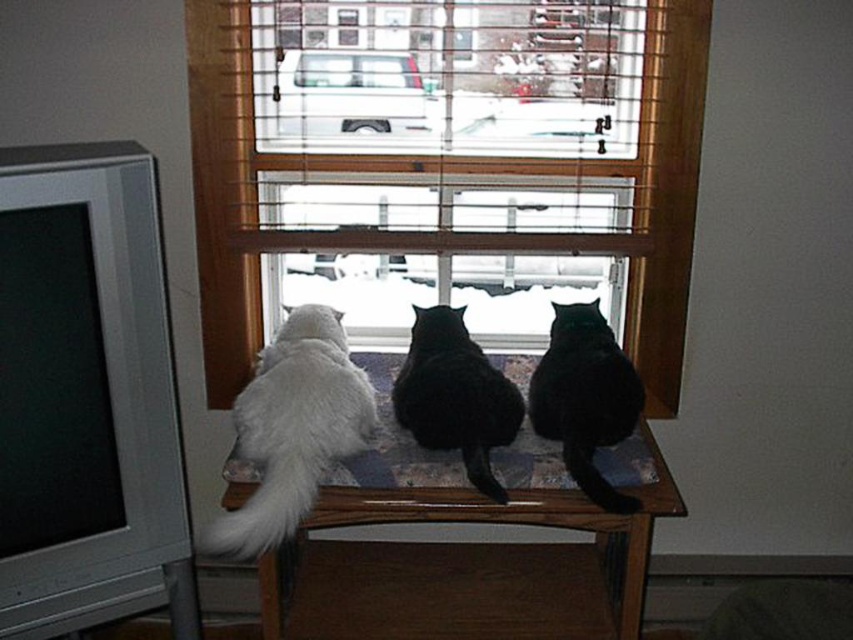
You are a photographer trying to capture the cats on the wooden table near the window. You want to arrange them so that the white fluffy cat at center is to the right of the black fur cat at center. Is this possible based on their current positions?

The white fluffy cat at center is currently to the left of the black fur cat at center, so to arrange them with the white fluffy cat at center to the right of the black fur cat at center, they would need to switch positions.

You are standing in front of the window and see the three cats on the wooden table. Which cat is exactly at the point with coordinates (293, 428)?

The point with coordinates (293, 428) is located on the white fluffy cat at center.